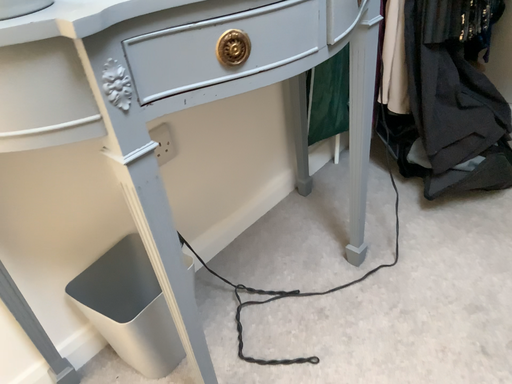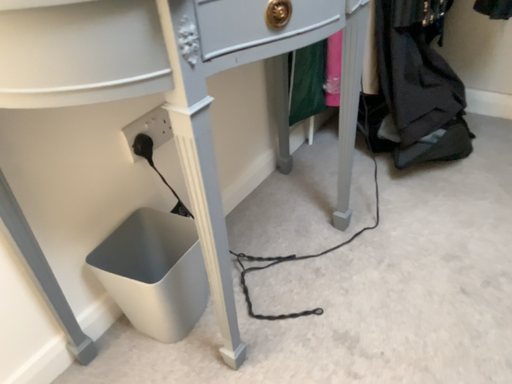
Question: Which way did the camera rotate in the video?

Choices:
 (A) rotated right
 (B) rotated left

Answer: (A)